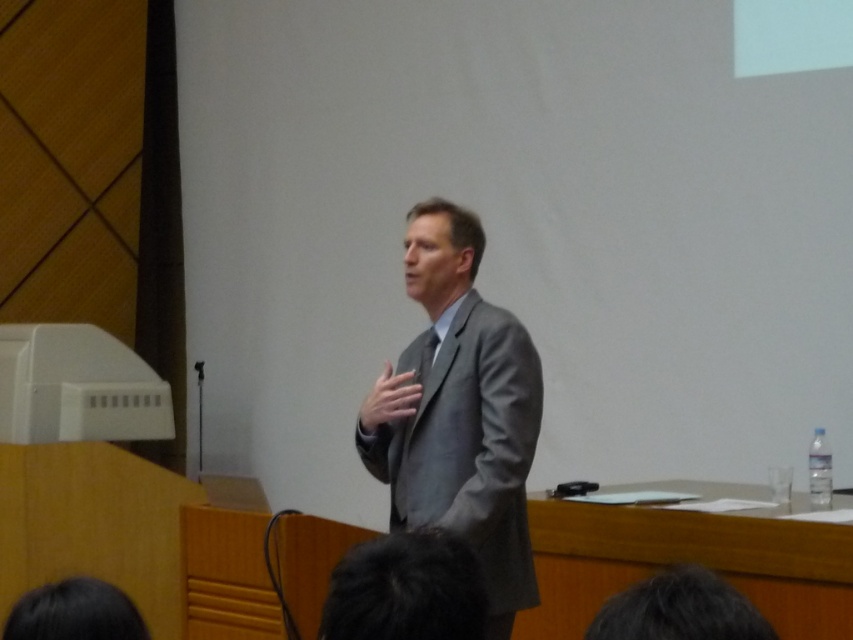
Question: Is gray matte suit at center in front of dark brown hair at lower left?

Choices:
 (A) no
 (B) yes

Answer: (A)

Question: Which object appears farthest from the camera in this image?

Choices:
 (A) dark hair at lower center
 (B) gray matte suit at center
 (C) dark brown hair at lower left
 (D) dark brown hair at lower center

Answer: (B)

Question: Which point appears farthest from the camera in this image?

Choices:
 (A) (105, 609)
 (B) (387, 540)
 (C) (724, 582)
 (D) (518, 412)

Answer: (D)

Question: Can you confirm if gray matte suit at center is thinner than dark hair at lower center?

Choices:
 (A) yes
 (B) no

Answer: (B)

Question: Which point is closer to the camera taking this photo?

Choices:
 (A) (55, 637)
 (B) (358, 568)
 (C) (769, 637)
 (D) (418, 278)

Answer: (C)

Question: Can you confirm if dark brown hair at lower center is bigger than dark brown hair at lower left?

Choices:
 (A) yes
 (B) no

Answer: (A)